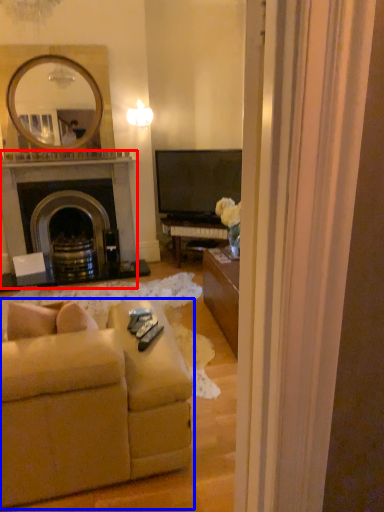
Question: Which object is further to the camera taking this photo, fireplace (highlighted by a red box) or studio couch (highlighted by a blue box)?

Choices:
 (A) fireplace
 (B) studio couch

Answer: (A)